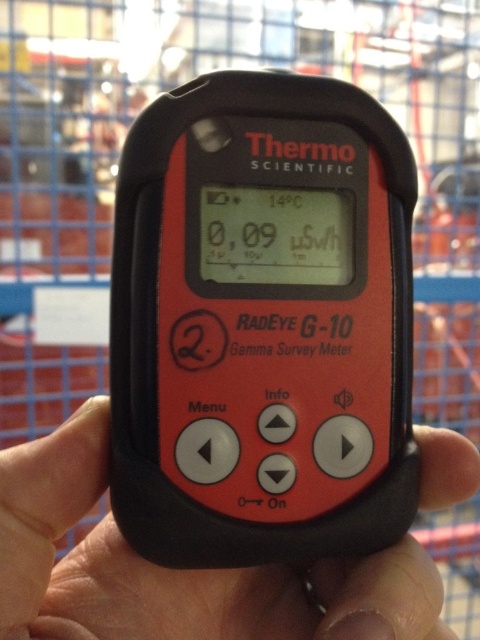
Based on the scene description, where is the matte black thermometer at center located in terms of coordinates?

The matte black thermometer at center is located at coordinates point [262,324].

You are a safety inspector checking the gamma radiation levels in a facility. You notice the black matte hand at center holding the matte black thermometer at center. Based on the scene, can you determine if the hand is touching the thermometer or just holding it from a distance?

The black matte hand at center is behind matte black thermometer at center, so the hand is touching the thermometer since it is positioned directly behind it, indicating a secure grip.